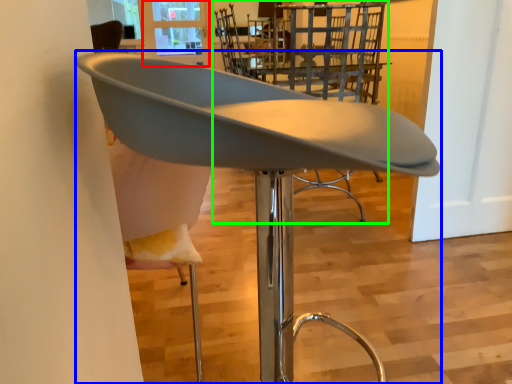
Question: Estimate the real-world distances between objects in this image. Which object is farther from window screen (highlighted by a red box), chair (highlighted by a blue box) or chair (highlighted by a green box)?

Choices:
 (A) chair
 (B) chair

Answer: (A)